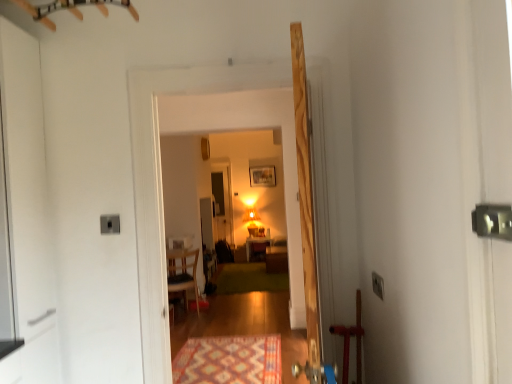
What do you see at coordinates (306, 216) in the screenshot? Image resolution: width=512 pixels, height=384 pixels. I see `wooden door at center` at bounding box center [306, 216].

Image resolution: width=512 pixels, height=384 pixels. What do you see at coordinates (249, 127) in the screenshot?
I see `wooden floor at center` at bounding box center [249, 127].

Measure the distance between multicolored woven mat at lower center, which appears as the 2th mat when viewed from the back, and camera.

The distance of multicolored woven mat at lower center, which appears as the 2th mat when viewed from the back, from camera is 3.23 meters.

Describe the element at coordinates (229, 360) in the screenshot. The height and width of the screenshot is (384, 512). I see `multicolored woven mat at lower center, which ranks as the 1th mat in front-to-back order` at that location.

Where is `green carpet at center, positioned as the 2th mat in front-to-back order`? green carpet at center, positioned as the 2th mat in front-to-back order is located at coordinates (249, 279).

The image size is (512, 384). Describe the element at coordinates (262, 176) in the screenshot. I see `matte wooden frame at upper center` at that location.

Identify the location of matte wooden table at center. (257, 248).

At what (x,y) coordinates should I click in order to perform the action: click on wooden door at center. Please return your answer as a coordinate pair (x, y). Looking at the image, I should click on (306, 216).

Does matte wooden frame at upper center have a greater height compared to multicolored woven mat at lower center, which ranks as the 1th mat in front-to-back order?

Correct, matte wooden frame at upper center is much taller as multicolored woven mat at lower center, which ranks as the 1th mat in front-to-back order.

From the image's perspective, which one is positioned lower, matte wooden frame at upper center or multicolored woven mat at lower center, which ranks as the 1th mat in front-to-back order?

multicolored woven mat at lower center, which ranks as the 1th mat in front-to-back order, is shown below in the image.

Which is farther from the camera, (263, 184) or (209, 353)?

The point (263, 184) is farther from the camera.

Can you confirm if wooden door at center is positioned to the right of matte wooden table at center?

Correct, you'll find wooden door at center to the right of matte wooden table at center.

From a real-world perspective, which object rests below the other?

matte wooden table at center is physically lower.

Which point is more distant from viewer, [207,148] or [187,272]?

The point [207,148] is farther.

Considering the positions of objects wooden picture frame at upper center and wooden armchair at center in the image provided, who is more to the right, wooden picture frame at upper center or wooden armchair at center?

From the viewer's perspective, wooden picture frame at upper center appears more on the right side.

Is wooden picture frame at upper center further to the viewer compared to wooden armchair at center?

Yes, wooden picture frame at upper center is further from the viewer.

Is wooden picture frame at upper center directly adjacent to wooden armchair at center?

No, wooden picture frame at upper center is not with wooden armchair at center.

Considering the points (268, 182) and (239, 277), which point is behind, point (268, 182) or point (239, 277)?

Positioned behind is point (268, 182).

Consider the image. Could you measure the distance between matte wooden frame at upper center and green carpet at center, positioned as the 2th mat in front-to-back order?

They are 1.68 meters apart.

Considering the relative sizes of matte wooden frame at upper center and green carpet at center, the first mat viewed from the back, in the image provided, is matte wooden frame at upper center shorter than green carpet at center, the first mat viewed from the back,?

Incorrect, the height of matte wooden frame at upper center does not fall short of that of green carpet at center, the first mat viewed from the back.

From the image's perspective, does matte wooden frame at upper center appear higher than green carpet at center, positioned as the 2th mat in front-to-back order?

Yes, from the image's perspective, matte wooden frame at upper center is on top of green carpet at center, positioned as the 2th mat in front-to-back order.

From a real-world perspective, is matte wooden frame at upper center positioned above or below matte wooden table at center?

matte wooden frame at upper center is above matte wooden table at center.

The image size is (512, 384). In order to click on painting lying above the matte wooden table at center (from the image's perspective) in this screenshot , I will do `click(262, 176)`.

Which object is positioned more to the right, matte wooden frame at upper center or matte wooden table at center?

From the viewer's perspective, matte wooden frame at upper center appears more on the right side.

Is matte wooden frame at upper center aimed at matte wooden table at center?

No, matte wooden frame at upper center is not turned towards matte wooden table at center.

Can you confirm if green carpet at center, positioned as the 2th mat in front-to-back order, is positioned to the right of wooden armchair at center?

Yes.

Considering the positions of objects green carpet at center, the first mat viewed from the back, and wooden armchair at center in the image provided, who is behind, green carpet at center, the first mat viewed from the back, or wooden armchair at center?

green carpet at center, the first mat viewed from the back, is further from the camera.

From the image's perspective, which is above, green carpet at center, the first mat viewed from the back, or wooden armchair at center?

wooden armchair at center.

Between green carpet at center, positioned as the 2th mat in front-to-back order, and wooden armchair at center, which one has larger size?

With larger size is wooden armchair at center.

Based on the photo, from the image's perspective, between wooden floor at center and wooden armchair at center, who is located below?

wooden armchair at center is shown below in the image.

Between wooden floor at center and wooden armchair at center, which one has more height?

wooden floor at center is taller.

Considering the relative sizes of wooden floor at center and wooden armchair at center in the image provided, is wooden floor at center bigger than wooden armchair at center?

Actually, wooden floor at center might be smaller than wooden armchair at center.

Would you say wooden floor at center is outside wooden armchair at center?

Absolutely, wooden floor at center is external to wooden armchair at center.

Where is `painting on the right of multicolored woven mat at lower center, which appears as the 2th mat when viewed from the back`? painting on the right of multicolored woven mat at lower center, which appears as the 2th mat when viewed from the back is located at coordinates (262, 176).

At what (x,y) coordinates should I click in order to perform the action: click on table that appears on the left of wooden door at center. Please return your answer as a coordinate pair (x, y). Looking at the image, I should click on (257, 248).

Estimate the real-world distances between objects in this image. Which object is further from wooden picture frame at upper center, wooden floor at center or matte wooden frame at upper center?

Among the two, wooden floor at center is located further to wooden picture frame at upper center.

Looking at the image, which one is located further to green carpet at center, positioned as the 2th mat in front-to-back order, wooden picture frame at upper center or wooden armchair at center?

The object further to green carpet at center, positioned as the 2th mat in front-to-back order, is wooden picture frame at upper center.

Considering their positions, is green carpet at center, positioned as the 2th mat in front-to-back order, positioned closer to matte wooden frame at upper center than matte wooden table at center?

The object closer to matte wooden frame at upper center is matte wooden table at center.

When comparing their distances from matte wooden frame at upper center, does matte wooden table at center or multicolored woven mat at lower center, which ranks as the 1th mat in front-to-back order, seem closer?

matte wooden table at center is positioned closer to the anchor matte wooden frame at upper center.

Estimate the real-world distances between objects in this image. Which object is further from green carpet at center, the first mat viewed from the back, wooden picture frame at upper center or wooden floor at center?

wooden floor at center is positioned further to the anchor green carpet at center, the first mat viewed from the back.

Estimate the real-world distances between objects in this image. Which object is closer to multicolored woven mat at lower center, which appears as the 2th mat when viewed from the back, wooden picture frame at upper center or wooden armchair at center?

wooden armchair at center lies closer to multicolored woven mat at lower center, which appears as the 2th mat when viewed from the back, than the other object.

Estimate the real-world distances between objects in this image. Which object is further from matte wooden table at center, wooden picture frame at upper center or matte wooden frame at upper center?

The object further to matte wooden table at center is wooden picture frame at upper center.

Which object lies further to the anchor point wooden door at center, green carpet at center, positioned as the 2th mat in front-to-back order, or multicolored woven mat at lower center, which ranks as the 1th mat in front-to-back order?

Based on the image, green carpet at center, positioned as the 2th mat in front-to-back order, appears to be further to wooden door at center.

The image size is (512, 384). In order to click on table between green carpet at center, positioned as the 2th mat in front-to-back order, and matte wooden frame at upper center in the front-back direction in this screenshot , I will do tap(257, 248).

The height and width of the screenshot is (384, 512). In order to click on armchair positioned between wooden floor at center and matte wooden table at center from near to far in this screenshot , I will do `click(183, 272)`.

This screenshot has width=512, height=384. In order to click on mat between wooden door at center and wooden armchair at center from front to back in this screenshot , I will do `click(229, 360)`.

Where is `corridor between wooden door at center and wooden picture frame at upper center along the z-axis`? This screenshot has width=512, height=384. corridor between wooden door at center and wooden picture frame at upper center along the z-axis is located at coordinates (249, 127).